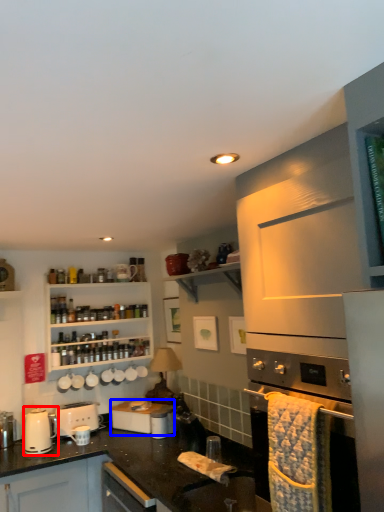
Question: Which point is further to the camera, kitchen appliance (highlighted by a red box) or appliance (highlighted by a blue box)?

Choices:
 (A) kitchen appliance
 (B) appliance

Answer: (B)